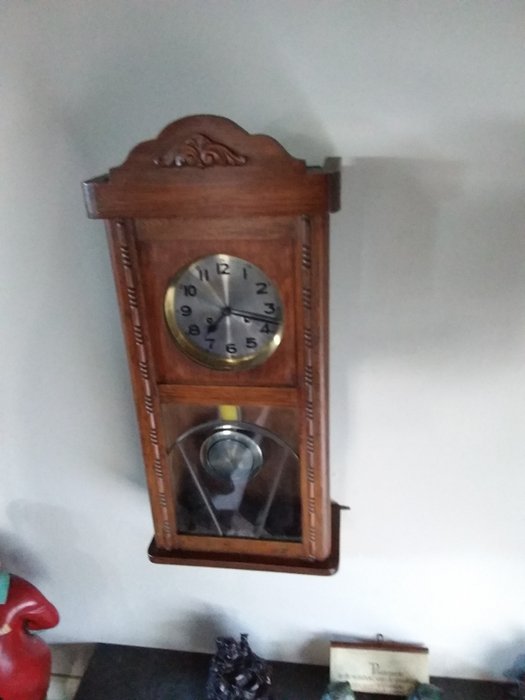
This screenshot has height=700, width=525. Find the location of `grandfather clock`. grandfather clock is located at coordinates (209, 210).